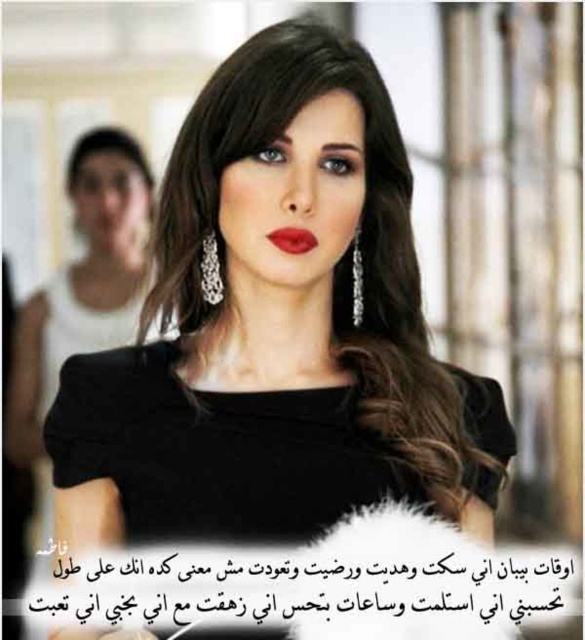
Who is more distant from viewer, (163, 198) or (132, 163)?

Positioned behind is point (132, 163).

Between shiny dark brown hair at center and black shiny hair at upper left, which one has less height?

With less height is black shiny hair at upper left.

Measure the distance between point (397,352) and camera.

They are 3.50 feet apart.

Where is `shiny dark brown hair at center`? Image resolution: width=585 pixels, height=640 pixels. shiny dark brown hair at center is located at coordinates (315, 246).

Does shiny dark brown hair at center appear under black paper text at lower center?

No, shiny dark brown hair at center is not below black paper text at lower center.

Is point (401, 408) in front of point (555, 564)?

Yes, it is in front of point (555, 564).

Between point (336, 170) and point (294, 570), which one is positioned in front?

Point (294, 570) is more forward.

The width and height of the screenshot is (585, 640). Find the location of `shiny dark brown hair at center`. shiny dark brown hair at center is located at coordinates (315, 246).

Is silver metallic earring at center to the right of silver metallic earring at upper center from the viewer's perspective?

In fact, silver metallic earring at center is to the left of silver metallic earring at upper center.

Can you confirm if silver metallic earring at center is taller than silver metallic earring at upper center?

No.

You are a GUI agent. You are given a task and a screenshot of the screen. Output one action in this format:
    pyautogui.click(x=<x>, y=<y>)
    Task: Click on the silver metallic earring at center
    This screenshot has width=585, height=640.
    Given the screenshot: What is the action you would take?
    pyautogui.click(x=211, y=269)